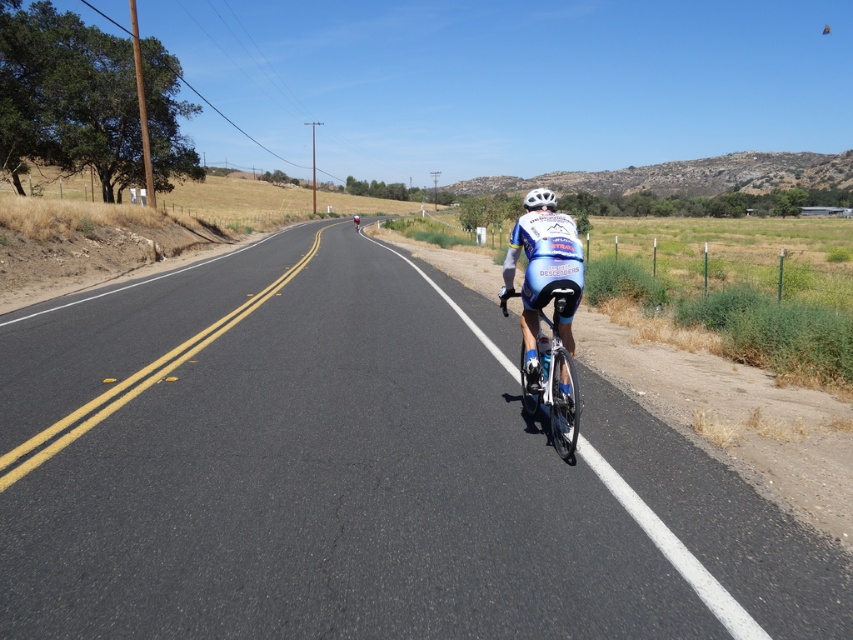
Does blue/white jersey at center appear under shiny blue frame at center?

Incorrect, blue/white jersey at center is not positioned below shiny blue frame at center.

Looking at this image, who is positioned more to the right, blue/white jersey at center or shiny blue frame at center?

shiny blue frame at center is more to the right.

The width and height of the screenshot is (853, 640). Describe the element at coordinates (543, 278) in the screenshot. I see `blue/white jersey at center` at that location.

Image resolution: width=853 pixels, height=640 pixels. Identify the location of blue/white jersey at center. (543, 278).

Does blue/white jersey at center have a greater width compared to white matte bicycle helmet at center?

Incorrect, blue/white jersey at center's width does not surpass white matte bicycle helmet at center's.

Can you confirm if blue/white jersey at center is shorter than white matte bicycle helmet at center?

Indeed, blue/white jersey at center has a lesser height compared to white matte bicycle helmet at center.

Image resolution: width=853 pixels, height=640 pixels. In order to click on blue/white jersey at center in this screenshot , I will do `click(543, 278)`.

Image resolution: width=853 pixels, height=640 pixels. In order to click on blue/white jersey at center in this screenshot , I will do `click(543, 278)`.

From the picture: Is white matte bicycle helmet at center closer to the viewer compared to blue jersey cyclist at center?

That is True.

Between point (538, 189) and point (352, 221), which one is positioned behind?

Positioned behind is point (352, 221).

The image size is (853, 640). I want to click on white matte bicycle helmet at center, so click(538, 198).

Image resolution: width=853 pixels, height=640 pixels. I want to click on white matte bicycle helmet at center, so click(x=538, y=198).